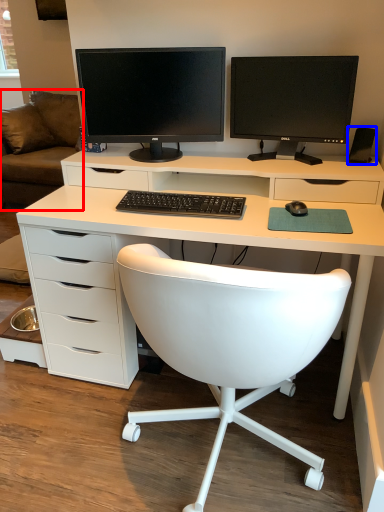
Question: Which object is further to the camera taking this photo, couch (highlighted by a red box) or speaker (highlighted by a blue box)?

Choices:
 (A) couch
 (B) speaker

Answer: (A)